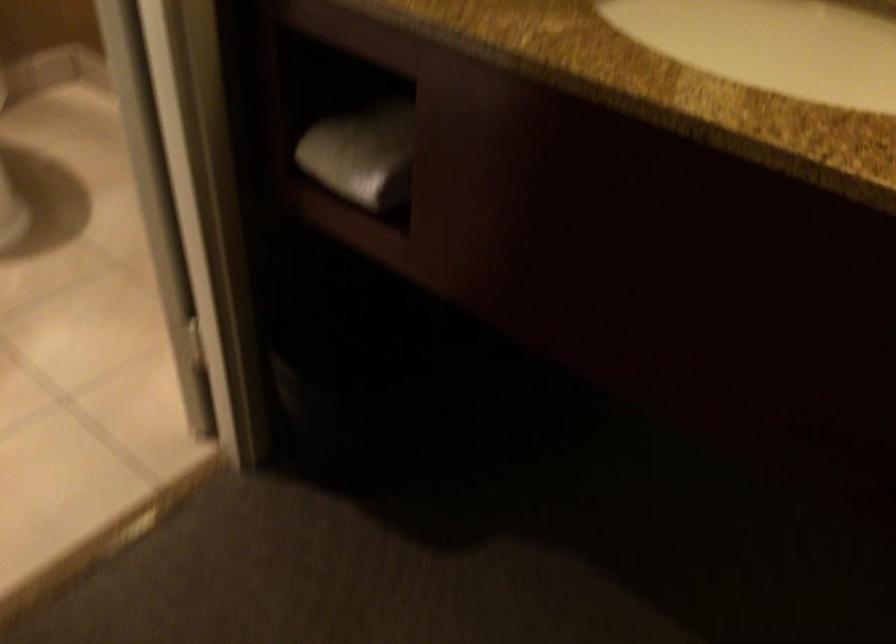
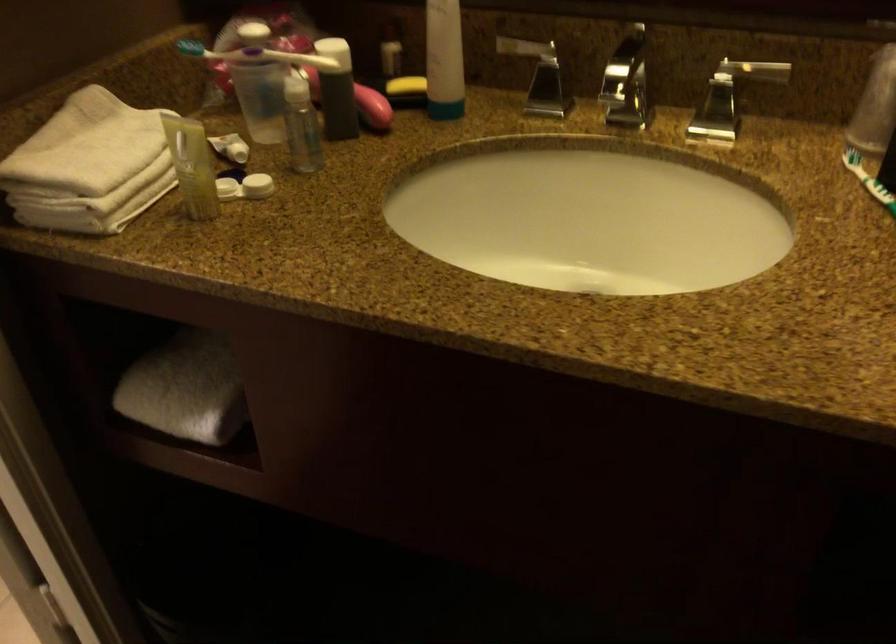
Question: The first image is from the beginning of the video and the second image is from the end. How did the camera likely rotate when shooting the video?

Choices:
 (A) Left
 (B) Right
 (C) Up
 (D) Down

Answer: (B)